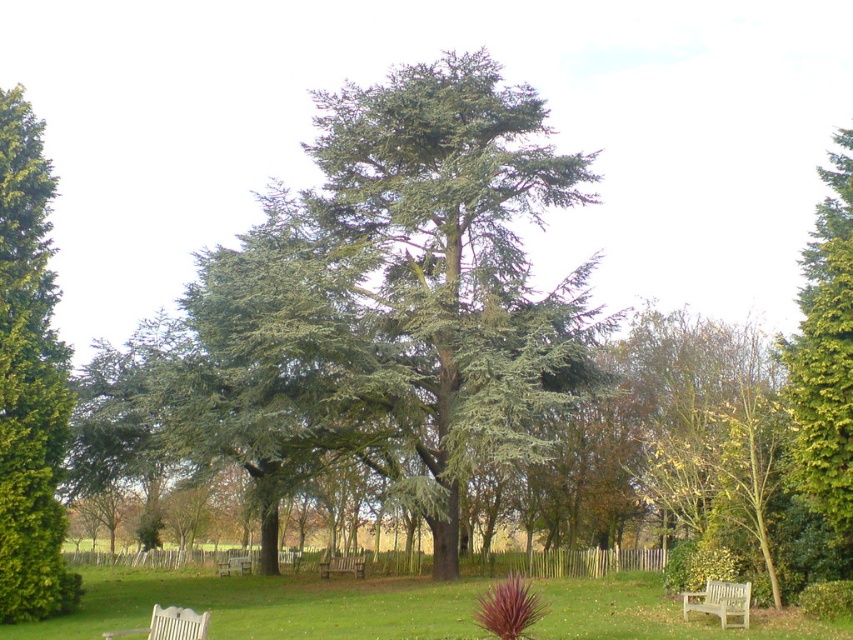
Question: Does green textured tree at right appear on the left side of wooden bench at lower center?

Choices:
 (A) no
 (B) yes

Answer: (A)

Question: Which of the following is the farthest from the observer?

Choices:
 (A) green textured hedge at left
 (B) green needle-like at center

Answer: (B)

Question: Which object is closer to the camera taking this photo?

Choices:
 (A) green textured tree at right
 (B) green needle-like at center
 (C) wooden park bench at center

Answer: (A)

Question: Which point is farther from the camera taking this photo?

Choices:
 (A) pos(270,374)
 (B) pos(12,144)
 (C) pos(705,596)
 (D) pos(247,561)

Answer: (D)

Question: Is green textured hedge at left positioned at the back of green textured tree at right?

Choices:
 (A) no
 (B) yes

Answer: (B)

Question: Can you confirm if wooden park bench at center is positioned below wooden bench at lower center?

Choices:
 (A) yes
 (B) no

Answer: (B)